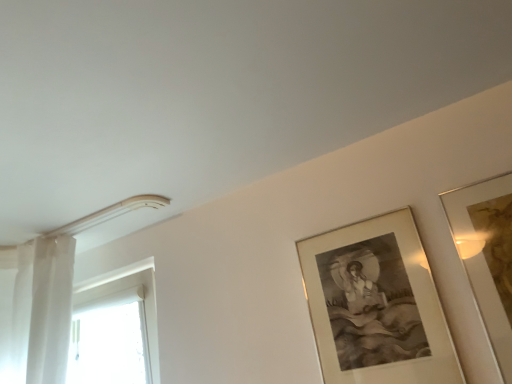
Question: Can you confirm if gold metallic picture frame at upper right, marked as the 1th picture frame in a right-to-left arrangement, is bigger than gold-framed artwork at upper right, arranged as the 2th picture frame when viewed from the right?

Choices:
 (A) no
 (B) yes

Answer: (A)

Question: Would you say gold metallic picture frame at upper right, which appears as the 2th picture frame when viewed from the left, is outside gold-framed artwork at upper right, the 1th picture frame viewed from the left?

Choices:
 (A) yes
 (B) no

Answer: (A)

Question: Are gold metallic picture frame at upper right, marked as the 1th picture frame in a right-to-left arrangement, and gold-framed artwork at upper right, arranged as the 2th picture frame when viewed from the right, beside each other?

Choices:
 (A) no
 (B) yes

Answer: (A)

Question: Is gold metallic picture frame at upper right, marked as the 1th picture frame in a right-to-left arrangement, far away from gold-framed artwork at upper right, the 1th picture frame viewed from the left?

Choices:
 (A) no
 (B) yes

Answer: (A)

Question: Can you confirm if gold metallic picture frame at upper right, marked as the 1th picture frame in a right-to-left arrangement, is positioned to the left of gold-framed artwork at upper right, arranged as the 2th picture frame when viewed from the right?

Choices:
 (A) no
 (B) yes

Answer: (A)

Question: From their relative heights in the image, would you say white glossy door at left is taller or shorter than gold metallic picture frame at upper right, which appears as the 2th picture frame when viewed from the left?

Choices:
 (A) short
 (B) tall

Answer: (A)

Question: Relative to gold metallic picture frame at upper right, which appears as the 2th picture frame when viewed from the left, is white glossy door at left in front or behind?

Choices:
 (A) front
 (B) behind

Answer: (B)

Question: From the image's perspective, is white glossy door at left above or below gold metallic picture frame at upper right, marked as the 1th picture frame in a right-to-left arrangement?

Choices:
 (A) below
 (B) above

Answer: (A)

Question: Visually, is white glossy door at left positioned to the left or to the right of gold metallic picture frame at upper right, which appears as the 2th picture frame when viewed from the left?

Choices:
 (A) right
 (B) left

Answer: (B)

Question: From a real-world perspective, is gold metallic picture frame at upper right, which appears as the 2th picture frame when viewed from the left, positioned above or below gold-framed artwork at upper right, arranged as the 2th picture frame when viewed from the right?

Choices:
 (A) below
 (B) above

Answer: (A)

Question: Relative to gold-framed artwork at upper right, arranged as the 2th picture frame when viewed from the right, is gold metallic picture frame at upper right, marked as the 1th picture frame in a right-to-left arrangement, in front or behind?

Choices:
 (A) behind
 (B) front

Answer: (B)

Question: Considering the positions of gold metallic picture frame at upper right, marked as the 1th picture frame in a right-to-left arrangement, and gold-framed artwork at upper right, the 1th picture frame viewed from the left, in the image, is gold metallic picture frame at upper right, marked as the 1th picture frame in a right-to-left arrangement, taller or shorter than gold-framed artwork at upper right, the 1th picture frame viewed from the left,?

Choices:
 (A) short
 (B) tall

Answer: (B)

Question: Is gold metallic picture frame at upper right, which appears as the 2th picture frame when viewed from the left, spatially inside gold-framed artwork at upper right, the 1th picture frame viewed from the left, or outside of it?

Choices:
 (A) outside
 (B) inside

Answer: (A)

Question: Is gold metallic picture frame at upper right, marked as the 1th picture frame in a right-to-left arrangement, situated inside white glossy door at left or outside?

Choices:
 (A) inside
 (B) outside

Answer: (B)

Question: Looking at the image, does gold metallic picture frame at upper right, marked as the 1th picture frame in a right-to-left arrangement, seem bigger or smaller compared to white glossy door at left?

Choices:
 (A) small
 (B) big

Answer: (A)